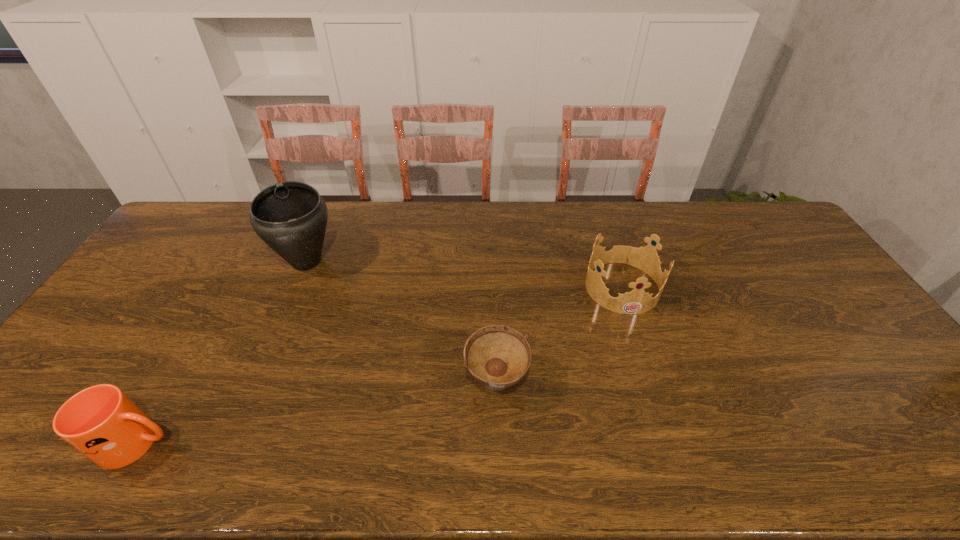
Where is `free space located 0.260m on the left of the third farthest object`? The image size is (960, 540). free space located 0.260m on the left of the third farthest object is located at coordinates (363, 383).

Image resolution: width=960 pixels, height=540 pixels. Identify the location of object located at the far edge. 290,217.

I want to click on object that is at the near edge, so click(101, 422).

Find the location of a particular element. This screenshot has height=540, width=960. blank space at the far edge is located at coordinates (332, 240).

Locate an element on the screen. free space at the near edge of the desktop is located at coordinates (477, 461).

What are the coordinates of `vacant region at the left edge of the desktop` in the screenshot? It's located at (142, 284).

Where is `free space at the right edge`? free space at the right edge is located at coordinates (805, 287).

This screenshot has height=540, width=960. Find the location of `free space at the far left corner of the desktop`. free space at the far left corner of the desktop is located at coordinates [x=209, y=225].

The height and width of the screenshot is (540, 960). In the image, there is a desktop. What are the coordinates of `vacant space at the near left corner` in the screenshot? It's located at (38, 447).

The width and height of the screenshot is (960, 540). In order to click on vacant area that lies between the tiara and the soup bowl in this screenshot , I will do `click(559, 335)`.